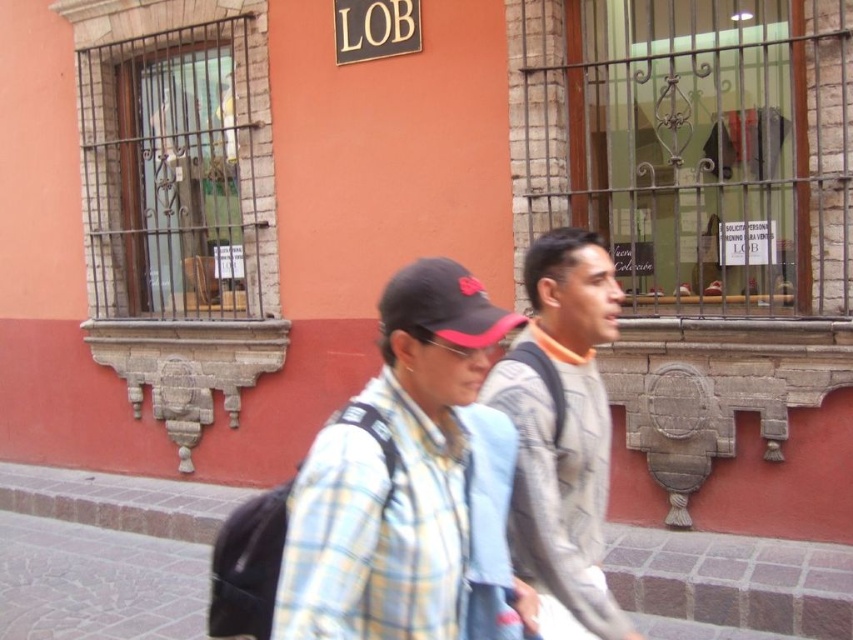
Between point (595, 592) and point (741, 600), which one is positioned behind?

Positioned behind is point (741, 600).

What do you see at coordinates (561, 433) in the screenshot? The image size is (853, 640). I see `plaid fabric shirt at center` at bounding box center [561, 433].

You are a GUI agent. You are given a task and a screenshot of the screen. Output one action in this format:
    pyautogui.click(x=<x>, y=<y>)
    Task: Click on the plaid fabric shirt at center
    The height and width of the screenshot is (640, 853).
    Given the screenshot: What is the action you would take?
    pyautogui.click(x=561, y=433)

Does plaid fabric shirt at center appear over gray textured sweater at center?

Indeed, plaid fabric shirt at center is positioned over gray textured sweater at center.

Does plaid fabric shirt at center have a smaller size compared to gray textured sweater at center?

Correct, plaid fabric shirt at center occupies less space than gray textured sweater at center.

The width and height of the screenshot is (853, 640). Identify the location of plaid fabric shirt at center. pyautogui.click(x=561, y=433).

Which of these two, gray textured sweater at center or brick pavement at center, stands taller?

With more height is gray textured sweater at center.

Is gray textured sweater at center below brick pavement at center?

No, gray textured sweater at center is not below brick pavement at center.

Is point (552, 570) positioned before point (73, 584)?

That is True.

Where is `gray textured sweater at center`? The height and width of the screenshot is (640, 853). gray textured sweater at center is located at coordinates (563, 435).